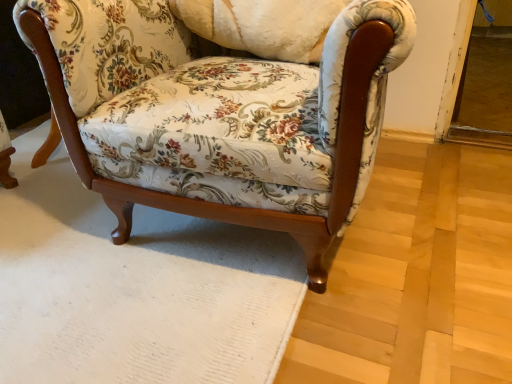
Question: Considering the relative sizes of floral fabric pillow at center and floral fabric chair at center in the image provided, is floral fabric pillow at center bigger than floral fabric chair at center?

Choices:
 (A) yes
 (B) no

Answer: (B)

Question: Is floral fabric chair at center inside floral fabric pillow at center?

Choices:
 (A) yes
 (B) no

Answer: (B)

Question: From a real-world perspective, does floral fabric pillow at center sit lower than floral fabric chair at center?

Choices:
 (A) yes
 (B) no

Answer: (B)

Question: Considering the relative positions of floral fabric pillow at center and floral fabric chair at center in the image provided, is floral fabric pillow at center to the right of floral fabric chair at center from the viewer's perspective?

Choices:
 (A) yes
 (B) no

Answer: (B)

Question: Does floral fabric pillow at center have a smaller size compared to floral fabric chair at center?

Choices:
 (A) no
 (B) yes

Answer: (B)

Question: From the image's perspective, is floral fabric pillow at center beneath floral fabric chair at center?

Choices:
 (A) no
 (B) yes

Answer: (A)

Question: Can you confirm if floral fabric chair at center is bigger than floral fabric pillow at center?

Choices:
 (A) yes
 (B) no

Answer: (A)

Question: From a real-world perspective, is floral fabric chair at center over floral fabric pillow at center?

Choices:
 (A) no
 (B) yes

Answer: (A)

Question: Is floral fabric pillow at center located within floral fabric chair at center?

Choices:
 (A) yes
 (B) no

Answer: (A)

Question: Does floral fabric chair at center have a lesser height compared to floral fabric pillow at center?

Choices:
 (A) no
 (B) yes

Answer: (A)

Question: Considering the relative sizes of floral fabric chair at center and floral fabric pillow at center in the image provided, is floral fabric chair at center wider than floral fabric pillow at center?

Choices:
 (A) no
 (B) yes

Answer: (B)

Question: From the image's perspective, is floral fabric chair at center below floral fabric pillow at center?

Choices:
 (A) yes
 (B) no

Answer: (A)

Question: Is floral fabric chair at center inside the boundaries of floral fabric pillow at center, or outside?

Choices:
 (A) outside
 (B) inside

Answer: (A)